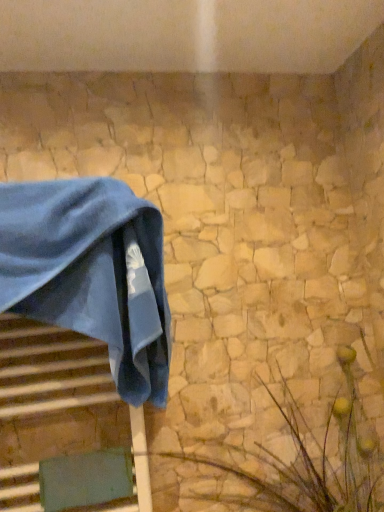
Question: Is blue velvet towel at left a part of green textured plant at lower right?

Choices:
 (A) yes
 (B) no

Answer: (B)

Question: Considering the relative positions of green textured plant at lower right and blue velvet towel at left in the image provided, is green textured plant at lower right to the right of blue velvet towel at left from the viewer's perspective?

Choices:
 (A) no
 (B) yes

Answer: (B)

Question: Is green textured plant at lower right facing away from blue velvet towel at left?

Choices:
 (A) no
 (B) yes

Answer: (A)

Question: Is green textured plant at lower right not within blue velvet towel at left?

Choices:
 (A) yes
 (B) no

Answer: (A)

Question: Can you confirm if green textured plant at lower right is wider than blue velvet towel at left?

Choices:
 (A) yes
 (B) no

Answer: (A)

Question: Can you see green textured plant at lower right touching blue velvet towel at left?

Choices:
 (A) yes
 (B) no

Answer: (B)

Question: Is blue velvet towel at left closer to camera compared to green textured plant at lower right?

Choices:
 (A) no
 (B) yes

Answer: (A)

Question: Is the depth of blue velvet towel at left greater than that of green textured plant at lower right?

Choices:
 (A) yes
 (B) no

Answer: (A)

Question: Is blue velvet towel at left outside green textured plant at lower right?

Choices:
 (A) no
 (B) yes

Answer: (B)

Question: Is blue velvet towel at left touching green textured plant at lower right?

Choices:
 (A) no
 (B) yes

Answer: (A)

Question: From a real-world perspective, is blue velvet towel at left on green textured plant at lower right?

Choices:
 (A) no
 (B) yes

Answer: (B)

Question: Is green textured plant at lower right completely or partially inside blue velvet towel at left?

Choices:
 (A) yes
 (B) no

Answer: (B)

Question: Looking at their shapes, would you say green textured plant at lower right is wider or thinner than blue velvet towel at left?

Choices:
 (A) wide
 (B) thin

Answer: (A)